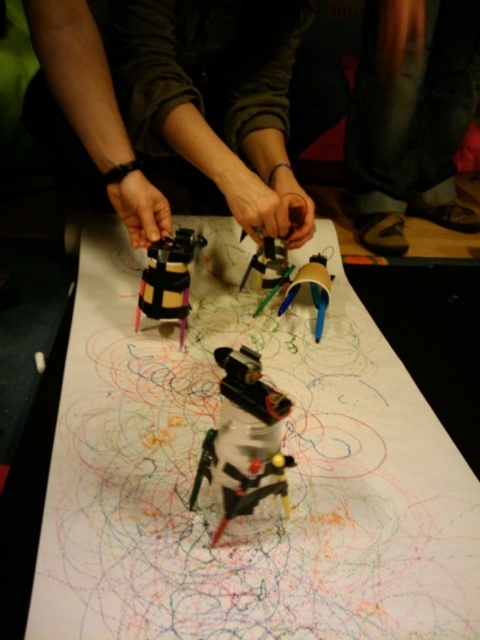
Between matte black robot at center and dark gray pants at lower center, which one is positioned lower?

Positioned lower is matte black robot at center.

Describe the element at coordinates (224, 97) in the screenshot. The image size is (480, 640). I see `matte black robot at center` at that location.

Where is `matte black robot at center`? This screenshot has width=480, height=640. matte black robot at center is located at coordinates (224, 97).

Consider the image. Can you confirm if matte black robot at center is shorter than matte plastic toy at center?

No, matte black robot at center is not shorter than matte plastic toy at center.

From the picture: Can you confirm if matte black robot at center is taller than matte plastic toy at center?

Indeed, matte black robot at center has a greater height compared to matte plastic toy at center.

Is point (250, 186) closer to camera compared to point (184, 232)?

That is False.

This screenshot has width=480, height=640. Find the location of `matte black robot at center`. matte black robot at center is located at coordinates (224, 97).

Is point (121, 424) positioned in front of point (276, 461)?

No, (121, 424) is further to viewer.

Can you confirm if white paper at center is bigger than metallic plastic robot at center?

Indeed, white paper at center has a larger size compared to metallic plastic robot at center.

Is point (254, 348) more distant than point (229, 474)?

Yes, point (254, 348) is behind point (229, 474).

Image resolution: width=480 pixels, height=640 pixels. What are the coordinates of `white paper at center` in the screenshot? It's located at click(x=264, y=500).